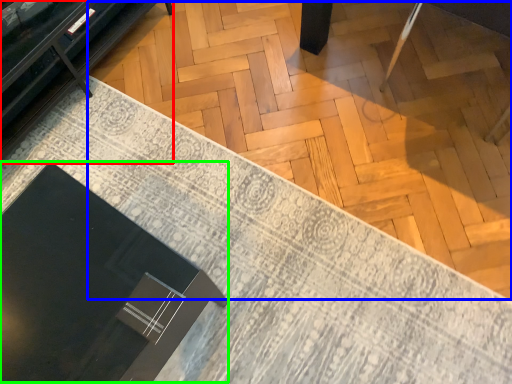
Question: Which object is the farthest from furniture (highlighted by a red box)? Choose among these: plywood (highlighted by a blue box) or round table (highlighted by a green box).

Choices:
 (A) plywood
 (B) round table

Answer: (B)